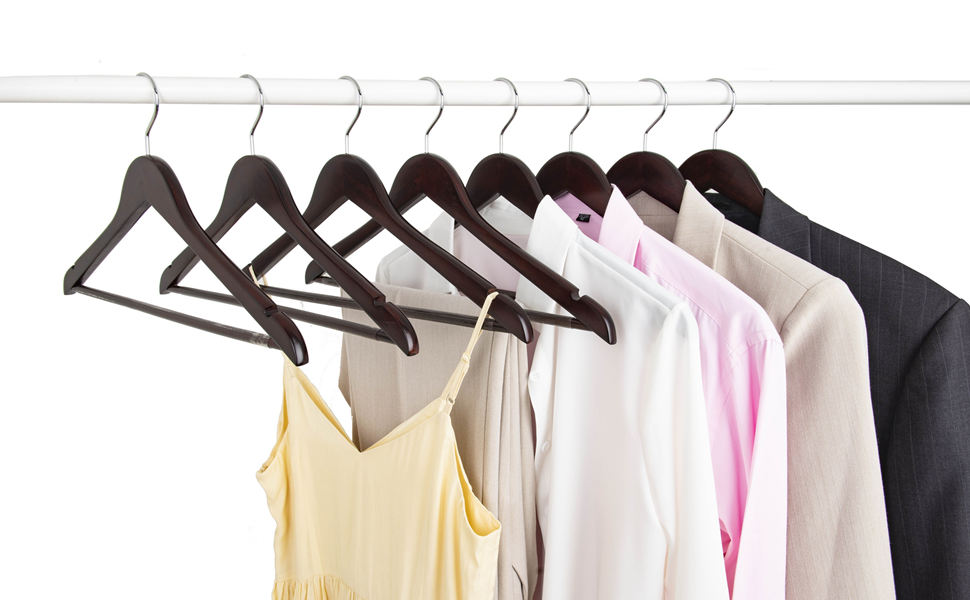
At what (x,y) coordinates should I click in order to perform the action: click on hangers. Please return your answer as a coordinate pair (x, y). The height and width of the screenshot is (600, 970). Looking at the image, I should click on (175, 216), (273, 190), (370, 191), (435, 183), (512, 175), (583, 171), (654, 167), (724, 164).